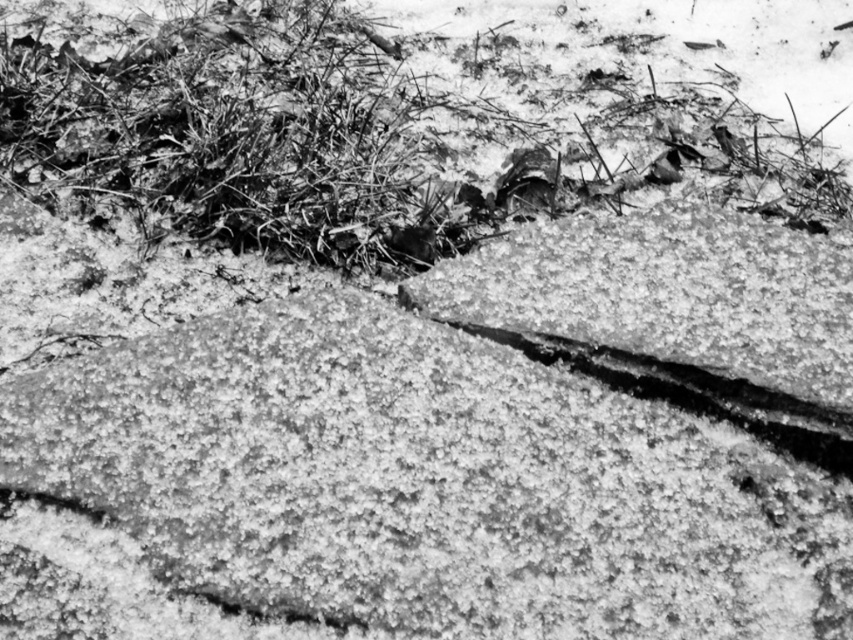
Question: Which point is closer to the camera?

Choices:
 (A) (683, 490)
 (B) (750, 3)

Answer: (A)

Question: Is smooth gray rock at center smaller than coarse textured grass at upper center?

Choices:
 (A) yes
 (B) no

Answer: (A)

Question: Does smooth gray rock at center have a larger size compared to coarse textured grass at upper center?

Choices:
 (A) yes
 (B) no

Answer: (B)

Question: Which of the following is the farthest from the observer?

Choices:
 (A) 814,577
 (B) 762,64

Answer: (B)

Question: Does smooth gray rock at center have a greater width compared to coarse textured grass at upper center?

Choices:
 (A) yes
 (B) no

Answer: (B)